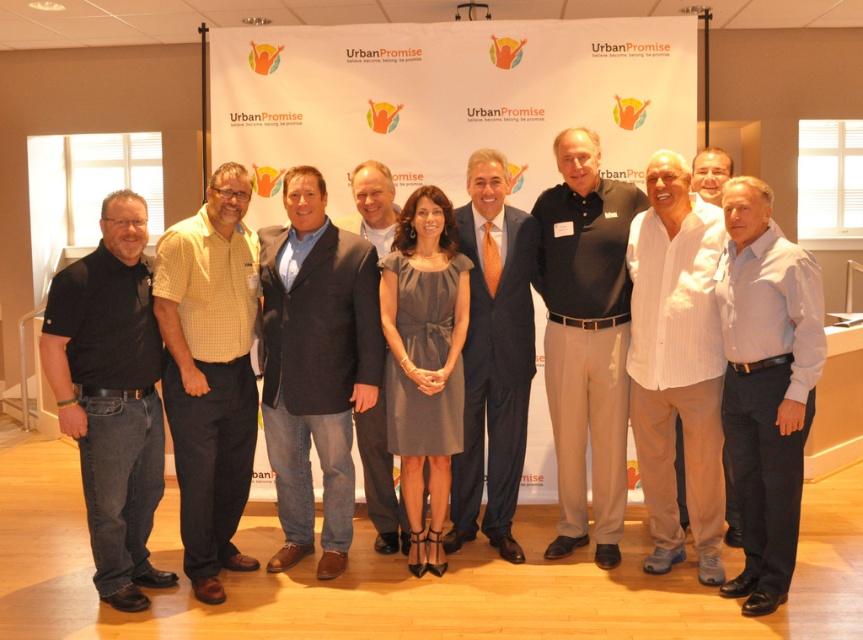
Is point (657, 168) more distant than point (427, 556)?

That is False.

Is the position of white striped shirt at center more distant than that of gray satin dress at center?

No, it is in front of gray satin dress at center.

The height and width of the screenshot is (640, 863). In order to click on white striped shirt at center in this screenshot , I will do `click(676, 364)`.

Is point (216, 401) in front of point (468, 209)?

Yes, point (216, 401) is in front of point (468, 209).

Does yellow checkered shirt at center appear under matte navy suit at center?

Correct, yellow checkered shirt at center is located below matte navy suit at center.

Between point (175, 250) and point (495, 460), which one is positioned in front?

Point (175, 250) is in front.

Locate an element on the screen. The image size is (863, 640). yellow checkered shirt at center is located at coordinates (210, 371).

Can you confirm if blue denim jeans at center is positioned to the right of matte navy suit at center?

Incorrect, blue denim jeans at center is not on the right side of matte navy suit at center.

Which of these two, blue denim jeans at center or matte navy suit at center, stands taller?

Standing taller between the two is matte navy suit at center.

The width and height of the screenshot is (863, 640). Describe the element at coordinates (315, 365) in the screenshot. I see `blue denim jeans at center` at that location.

Where is `blue denim jeans at center`? The height and width of the screenshot is (640, 863). blue denim jeans at center is located at coordinates (315, 365).